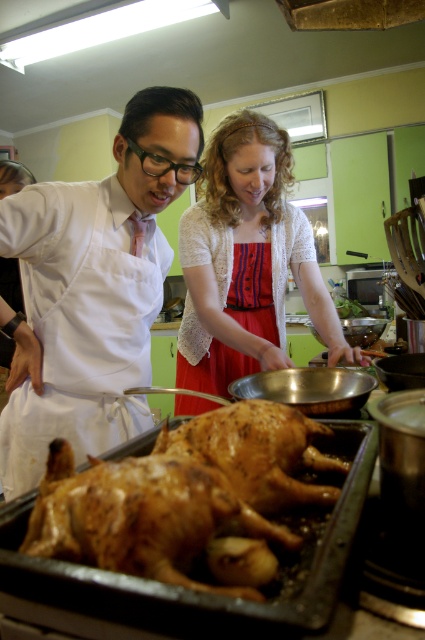
From the picture: Who is shorter, white apron at left or golden crispy skin at center?

Standing shorter between the two is golden crispy skin at center.

Which is more to the left, white apron at left or golden crispy skin at center?

From the viewer's perspective, white apron at left appears more on the left side.

This screenshot has width=425, height=640. Identify the location of white apron at left. (93, 289).

The width and height of the screenshot is (425, 640). Find the location of `white apron at left`. white apron at left is located at coordinates (93, 289).

This screenshot has height=640, width=425. Identify the location of red satin dress at center. (246, 260).

This screenshot has height=640, width=425. I want to click on red satin dress at center, so click(246, 260).

Is white apron at left bigger than red satin dress at center?

No, white apron at left is not bigger than red satin dress at center.

Between white apron at left and red satin dress at center, which one appears on the right side from the viewer's perspective?

red satin dress at center is more to the right.

Who is more distant from viewer, (31, 460) or (220, 157)?

Positioned behind is point (220, 157).

Where is `white apron at left`? This screenshot has width=425, height=640. white apron at left is located at coordinates (93, 289).